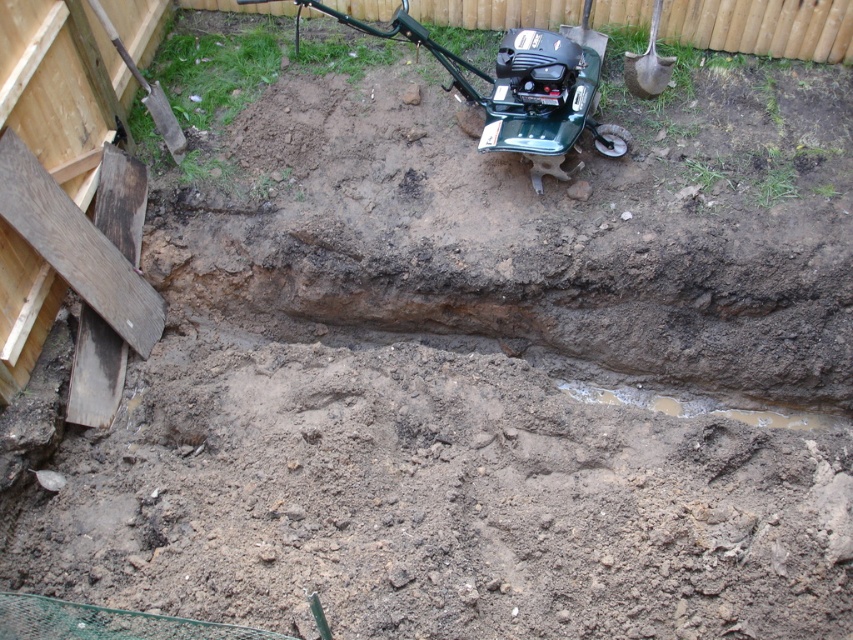
Between point (173, 152) and point (646, 60), which one is positioned behind?

Point (646, 60)

Can you confirm if wooden shovel at upper left is positioned to the left of brown wooden shovel at upper right?

Indeed, wooden shovel at upper left is positioned on the left side of brown wooden shovel at upper right.

Identify the location of wooden shovel at upper left. (146, 90).

Can you confirm if green metallic mower at center is positioned to the left of wooden shovel at upper left?

Incorrect, green metallic mower at center is not on the left side of wooden shovel at upper left.

Looking at this image, which is more to the right, green metallic mower at center or wooden shovel at upper left?

From the viewer's perspective, green metallic mower at center appears more on the right side.

Is point (346, 20) positioned behind point (161, 125)?

That is False.

Image resolution: width=853 pixels, height=640 pixels. Find the location of `green metallic mower at center`. green metallic mower at center is located at coordinates (520, 88).

Is green metallic mower at center to the left of brown wooden shovel at upper right from the viewer's perspective?

Indeed, green metallic mower at center is positioned on the left side of brown wooden shovel at upper right.

Identify the location of green metallic mower at center. (520, 88).

Image resolution: width=853 pixels, height=640 pixels. What are the coordinates of `green metallic mower at center` in the screenshot? It's located at (520, 88).